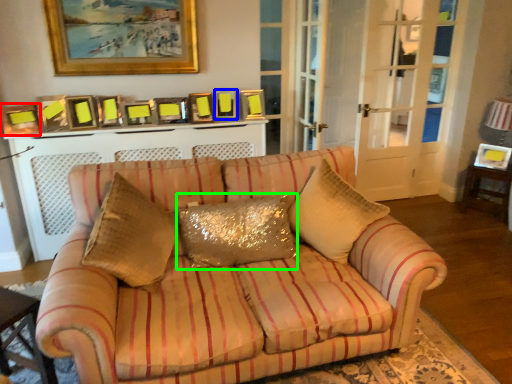
Question: Which object is the farthest from picture frame (highlighted by a red box)? Choose among these: picture frame (highlighted by a blue box) or pillow (highlighted by a green box).

Choices:
 (A) picture frame
 (B) pillow

Answer: (B)